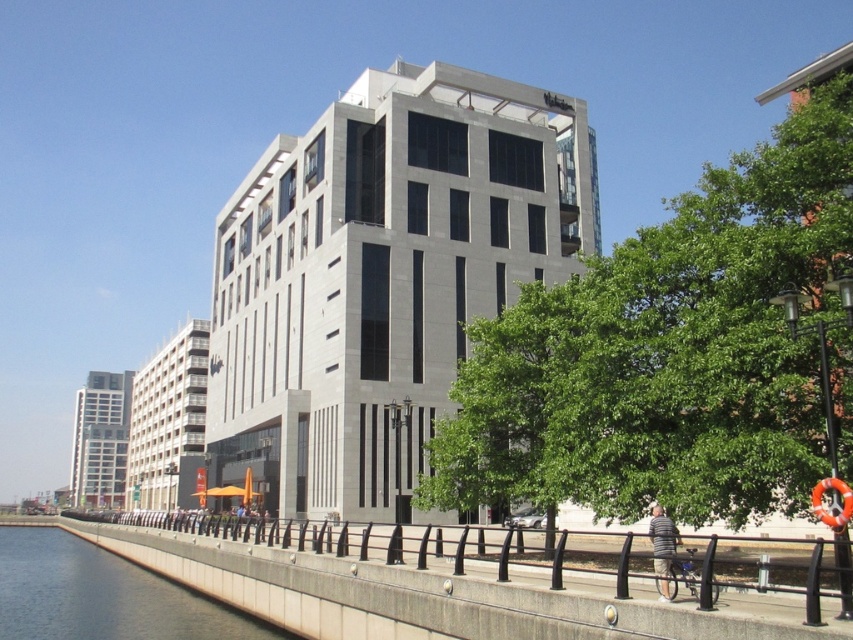
Question: Does gray concrete wall at lower left have a lesser width compared to striped cotton shirt at lower right?

Choices:
 (A) yes
 (B) no

Answer: (B)

Question: Which point is closer to the camera?

Choices:
 (A) gray concrete wall at lower left
 (B) striped cotton shirt at lower right

Answer: (B)

Question: Considering the relative positions of gray concrete wall at lower left and striped cotton shirt at lower right in the image provided, where is gray concrete wall at lower left located with respect to striped cotton shirt at lower right?

Choices:
 (A) left
 (B) right

Answer: (A)

Question: Can you confirm if gray concrete wall at lower left is wider than striped cotton shirt at lower right?

Choices:
 (A) yes
 (B) no

Answer: (A)

Question: Which object is closer to the camera taking this photo?

Choices:
 (A) gray concrete wall at lower left
 (B) striped cotton shirt at lower right

Answer: (B)